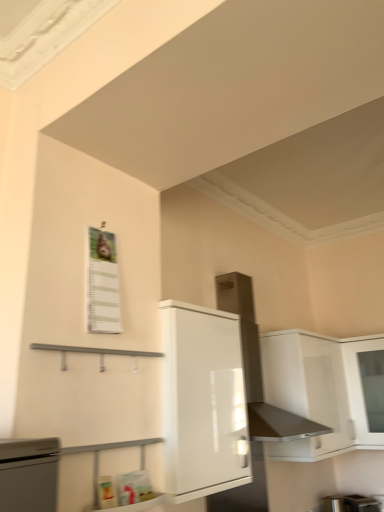
Where is `satin silver exhaust hood at upper center`? satin silver exhaust hood at upper center is located at coordinates (259, 368).

What are the coordinates of `exhaust hood above the metallic silver toaster at lower right (from the image's perspective)` in the screenshot? It's located at (259, 368).

Which object is positioned more to the left, metallic silver toaster at lower right or satin silver exhaust hood at upper center?

satin silver exhaust hood at upper center is more to the left.

In the scene shown: From a real-world perspective, between metallic silver toaster at lower right and satin silver exhaust hood at upper center, who is vertically higher?

From a 3D spatial view, satin silver exhaust hood at upper center is above.

Would you say metallic silver toaster at lower right is outside satin silver exhaust hood at upper center?

Indeed, metallic silver toaster at lower right is completely outside satin silver exhaust hood at upper center.

Considering the sizes of objects white glossy cabinet at center, which is counted as the first cabinetry, starting from the front, and satin silver exhaust hood at upper center in the image provided, who is bigger, white glossy cabinet at center, which is counted as the first cabinetry, starting from the front, or satin silver exhaust hood at upper center?

satin silver exhaust hood at upper center.

Is white glossy cabinet at center, which is counted as the first cabinetry, starting from the front, to the left of satin silver exhaust hood at upper center from the viewer's perspective?

Yes.

Is white glossy cabinet at center, the 2th cabinetry when ordered from right to left, positioned before satin silver exhaust hood at upper center?

Yes, it is.

Between point (246, 315) and point (347, 502), which one is positioned in front?

Point (246, 315)

How far apart are satin silver exhaust hood at upper center and metallic silver toaster at lower right?

satin silver exhaust hood at upper center and metallic silver toaster at lower right are 3.53 feet apart.

In the scene shown: Is satin silver exhaust hood at upper center outside of metallic silver toaster at lower right?

Yes, satin silver exhaust hood at upper center is located beyond the bounds of metallic silver toaster at lower right.

Is satin silver exhaust hood at upper center positioned in front of metallic silver toaster at lower right?

Yes, satin silver exhaust hood at upper center is in front of metallic silver toaster at lower right.

Would you say satin silver exhaust hood at upper center is a long distance from white glossy cabinet at center, which is the 1th cabinetry in left-to-right order?

No, satin silver exhaust hood at upper center is not far away from white glossy cabinet at center, which is the 1th cabinetry in left-to-right order.

What's the angular difference between satin silver exhaust hood at upper center and white glossy cabinet at center, the 2th cabinetry when ordered from right to left,'s facing directions?

The angular difference between satin silver exhaust hood at upper center and white glossy cabinet at center, the 2th cabinetry when ordered from right to left, is 3.52e-05 degrees.

Considering the sizes of satin silver exhaust hood at upper center and white glossy cabinet at center, which is counted as the second cabinetry, starting from the back, in the image, is satin silver exhaust hood at upper center wider or thinner than white glossy cabinet at center, which is counted as the second cabinetry, starting from the back,?

satin silver exhaust hood at upper center is wider than white glossy cabinet at center, which is counted as the second cabinetry, starting from the back.

Is satin silver exhaust hood at upper center taller or shorter than white glossy cabinet at center, which is counted as the first cabinetry, starting from the front?

satin silver exhaust hood at upper center is taller than white glossy cabinet at center, which is counted as the first cabinetry, starting from the front.

From their relative heights in the image, would you say white glossy cabinet at upper right, which is the first cabinetry in right-to-left order, is taller or shorter than white glossy cabinet at center, the 2th cabinetry when ordered from right to left?

In the image, white glossy cabinet at upper right, which is the first cabinetry in right-to-left order, appears to be taller than white glossy cabinet at center, the 2th cabinetry when ordered from right to left.

Considering the sizes of objects white glossy cabinet at upper right, which is the first cabinetry in right-to-left order, and white glossy cabinet at center, the 2th cabinetry when ordered from right to left, in the image provided, who is thinner, white glossy cabinet at upper right, which is the first cabinetry in right-to-left order, or white glossy cabinet at center, the 2th cabinetry when ordered from right to left,?

With smaller width is white glossy cabinet at center, the 2th cabinetry when ordered from right to left.

From the image's perspective, which one is positioned higher, white glossy cabinet at upper right, positioned as the second cabinetry in front-to-back order, or white glossy cabinet at center, which is counted as the first cabinetry, starting from the front?

white glossy cabinet at center, which is counted as the first cabinetry, starting from the front, is shown above in the image.

Considering the sizes of objects white glossy cabinet at upper right, which is counted as the first cabinetry, starting from the back, and white glossy cabinet at center, the 2th cabinetry when ordered from right to left, in the image provided, who is smaller, white glossy cabinet at upper right, which is counted as the first cabinetry, starting from the back, or white glossy cabinet at center, the 2th cabinetry when ordered from right to left,?

Smaller between the two is white glossy cabinet at center, the 2th cabinetry when ordered from right to left.

Considering the points (346, 444) and (337, 500), which point is in front, point (346, 444) or point (337, 500)?

The point (346, 444) is in front.

Does white glossy cabinet at upper right, the 2th cabinetry in the left-to-right sequence, have a smaller size compared to metallic silver toaster at lower right?

No, white glossy cabinet at upper right, the 2th cabinetry in the left-to-right sequence, is not smaller than metallic silver toaster at lower right.

From the picture: From the image's perspective, would you say white glossy cabinet at upper right, the 2th cabinetry in the left-to-right sequence, is shown under metallic silver toaster at lower right?

No, from the image's perspective, white glossy cabinet at upper right, the 2th cabinetry in the left-to-right sequence, is not beneath metallic silver toaster at lower right.

From a real-world perspective, count 2nd cabinetrys upward from the metallic silver toaster at lower right and point to it. Please provide its 2D coordinates.

[(318, 390)]

From the image's perspective, which one is positioned higher, white glossy cabinet at center, which is counted as the first cabinetry, starting from the front, or white glossy cabinet at upper right, positioned as the second cabinetry in front-to-back order?

white glossy cabinet at center, which is counted as the first cabinetry, starting from the front, is shown above in the image.

Are white glossy cabinet at center, which is the 1th cabinetry in left-to-right order, and white glossy cabinet at upper right, which is the first cabinetry in right-to-left order, located far from each other?

white glossy cabinet at center, which is the 1th cabinetry in left-to-right order, is near white glossy cabinet at upper right, which is the first cabinetry in right-to-left order, not far away.

Considering the relative positions of white glossy cabinet at center, the 2th cabinetry when ordered from right to left, and white glossy cabinet at upper right, which is the first cabinetry in right-to-left order, in the image provided, is white glossy cabinet at center, the 2th cabinetry when ordered from right to left, to the left or to the right of white glossy cabinet at upper right, which is the first cabinetry in right-to-left order,?

Based on their positions, white glossy cabinet at center, the 2th cabinetry when ordered from right to left, is located to the left of white glossy cabinet at upper right, which is the first cabinetry in right-to-left order.

Is white glossy cabinet at center, which is counted as the first cabinetry, starting from the front, positioned behind white glossy cabinet at upper right, the 2th cabinetry in the left-to-right sequence?

No, white glossy cabinet at center, which is counted as the first cabinetry, starting from the front, is closer to the viewer.

The width and height of the screenshot is (384, 512). In order to click on appliance behind the satin silver exhaust hood at upper center in this screenshot , I will do `click(351, 504)`.

The width and height of the screenshot is (384, 512). In order to click on exhaust hood that appears above the white glossy cabinet at center, the 2th cabinetry when ordered from right to left (from the image's perspective) in this screenshot , I will do `click(259, 368)`.

From the image, which object appears to be farther from white glossy cabinet at center, which is the 1th cabinetry in left-to-right order, metallic silver toaster at lower right or white glossy cabinet at upper right, which is the first cabinetry in right-to-left order?

metallic silver toaster at lower right.

Which object lies further to the anchor point satin silver exhaust hood at upper center, white glossy cabinet at center, which is counted as the first cabinetry, starting from the front, or white glossy cabinet at upper right, which is the first cabinetry in right-to-left order?

white glossy cabinet at center, which is counted as the first cabinetry, starting from the front.

Based on their spatial positions, is white glossy cabinet at upper right, the 2th cabinetry in the left-to-right sequence, or white glossy cabinet at center, which is counted as the second cabinetry, starting from the back, further from metallic silver toaster at lower right?

white glossy cabinet at center, which is counted as the second cabinetry, starting from the back.

Which object lies nearer to the anchor point metallic silver toaster at lower right, white glossy cabinet at upper right, which is counted as the first cabinetry, starting from the back, or satin silver exhaust hood at upper center?

white glossy cabinet at upper right, which is counted as the first cabinetry, starting from the back.

Looking at the image, which one is located closer to metallic silver toaster at lower right, satin silver exhaust hood at upper center or white glossy cabinet at center, which is counted as the second cabinetry, starting from the back?

satin silver exhaust hood at upper center is positioned closer to the anchor metallic silver toaster at lower right.

Estimate the real-world distances between objects in this image. Which object is further from white glossy cabinet at upper right, the 2th cabinetry in the left-to-right sequence, metallic silver toaster at lower right or satin silver exhaust hood at upper center?

Among the two, metallic silver toaster at lower right is located further to white glossy cabinet at upper right, the 2th cabinetry in the left-to-right sequence.

Estimate the real-world distances between objects in this image. Which object is further from white glossy cabinet at upper right, which is counted as the first cabinetry, starting from the back, white glossy cabinet at center, which is the 1th cabinetry in left-to-right order, or metallic silver toaster at lower right?

Among the two, white glossy cabinet at center, which is the 1th cabinetry in left-to-right order, is located further to white glossy cabinet at upper right, which is counted as the first cabinetry, starting from the back.

Estimate the real-world distances between objects in this image. Which object is further from white glossy cabinet at upper right, the 2th cabinetry in the left-to-right sequence, satin silver exhaust hood at upper center or white glossy cabinet at center, which is counted as the first cabinetry, starting from the front?

white glossy cabinet at center, which is counted as the first cabinetry, starting from the front, lies further to white glossy cabinet at upper right, the 2th cabinetry in the left-to-right sequence, than the other object.

Image resolution: width=384 pixels, height=512 pixels. Identify the location of exhaust hood located between white glossy cabinet at center, which is counted as the first cabinetry, starting from the front, and white glossy cabinet at upper right, the 2th cabinetry in the left-to-right sequence, in the left-right direction. (259, 368).

The image size is (384, 512). What are the coordinates of `cabinetry between white glossy cabinet at center, the 2th cabinetry when ordered from right to left, and metallic silver toaster at lower right from left to right` in the screenshot? It's located at (318, 390).